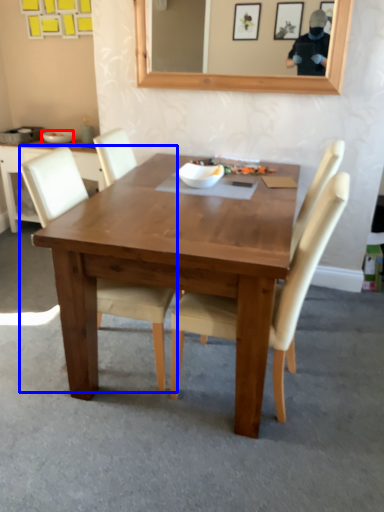
Question: Among these objects, which one is farthest to the camera, bowl (highlighted by a red box) or chair (highlighted by a blue box)?

Choices:
 (A) bowl
 (B) chair

Answer: (A)